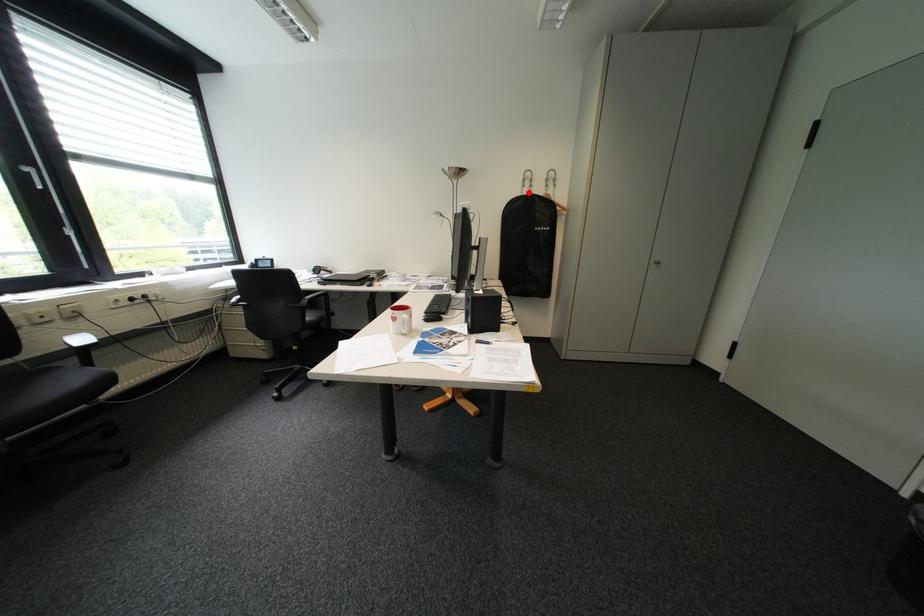
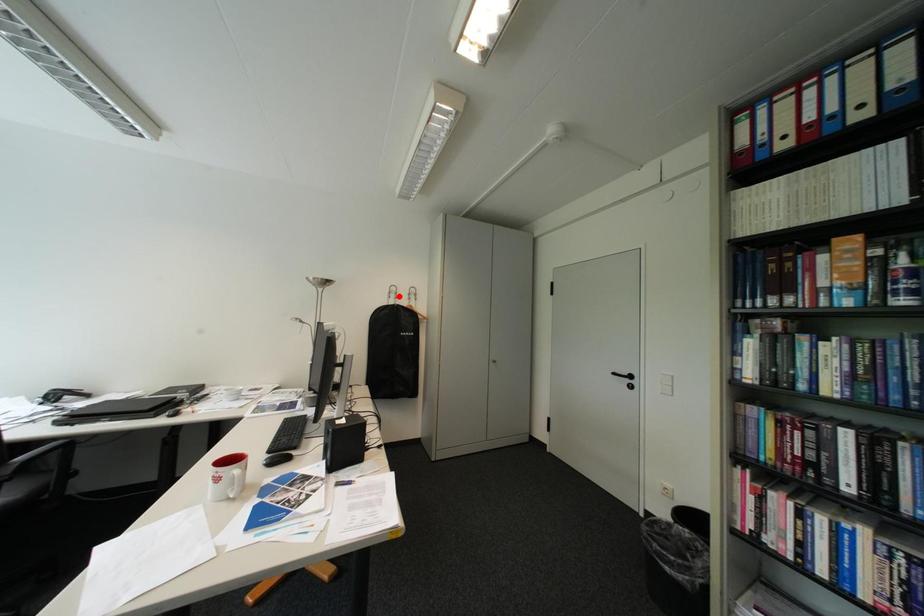
I am providing you with two images of the same scene from different viewpoints. A red point is marked on the first image and another point is marked on the second image. Does the point marked in image1 correspond to the same location as the one in image2?

No